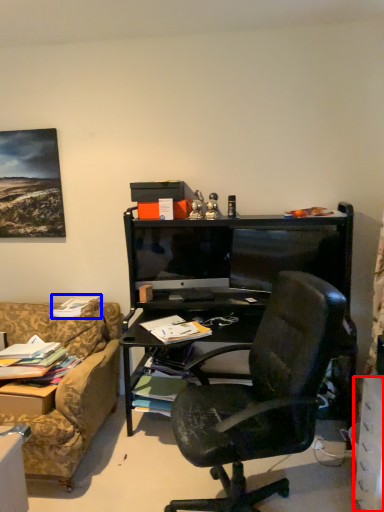
Question: Which object appears farthest to the camera in this image, drawer (highlighted by a red box) or book (highlighted by a blue box)?

Choices:
 (A) drawer
 (B) book

Answer: (B)